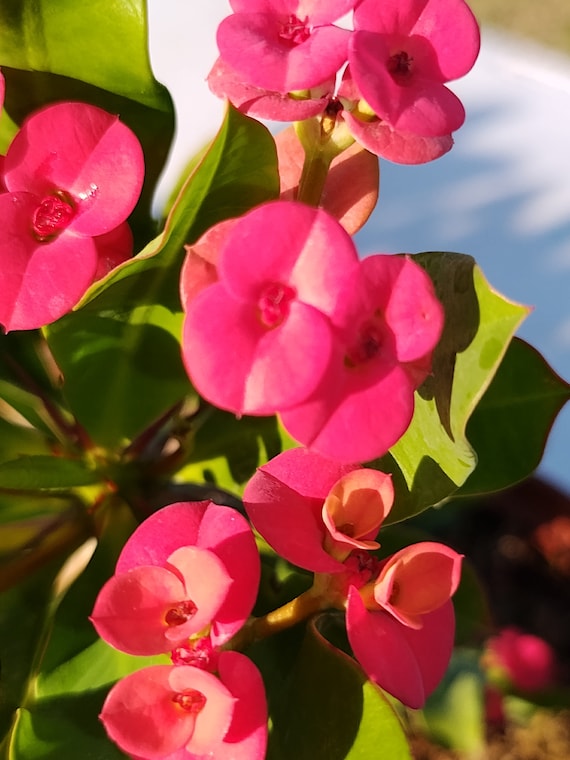
Where is `succulent`? The width and height of the screenshot is (570, 760). succulent is located at coordinates (115, 382).